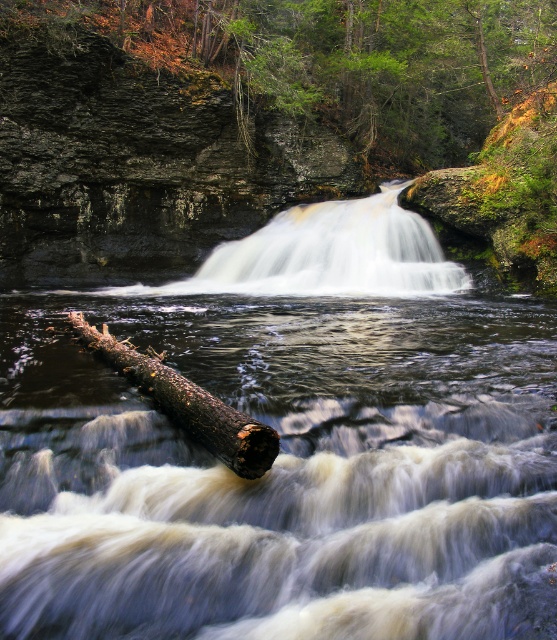
Does green mossy rock at upper center have a lesser height compared to dark brown rough log at lower center?

Incorrect, green mossy rock at upper center's height does not fall short of dark brown rough log at lower center's.

Image resolution: width=557 pixels, height=640 pixels. I want to click on green mossy rock at upper center, so click(339, 60).

Who is positioned more to the right, white frothy water at center or dark brown rough log at lower center?

white frothy water at center

The height and width of the screenshot is (640, 557). I want to click on white frothy water at center, so click(x=334, y=253).

Who is more forward, (x=295, y=232) or (x=77, y=310)?

Point (x=77, y=310)

This screenshot has width=557, height=640. I want to click on white frothy water at center, so click(x=334, y=253).

Can you confirm if green mossy rock at upper center is positioned to the right of white frothy water at center?

Indeed, green mossy rock at upper center is positioned on the right side of white frothy water at center.

Who is more distant from viewer, (443,124) or (242,276)?

Positioned behind is point (443,124).

I want to click on green mossy rock at upper center, so click(x=339, y=60).